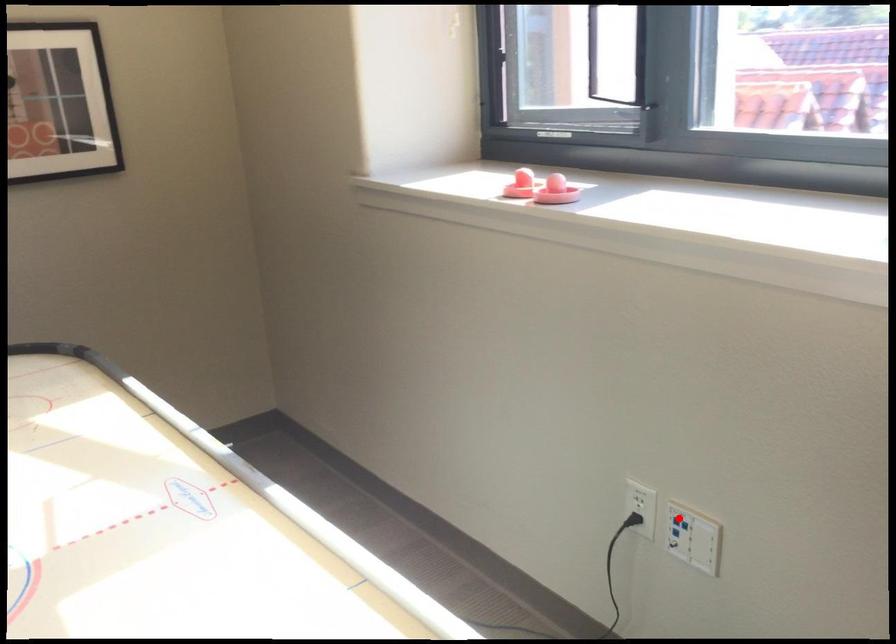
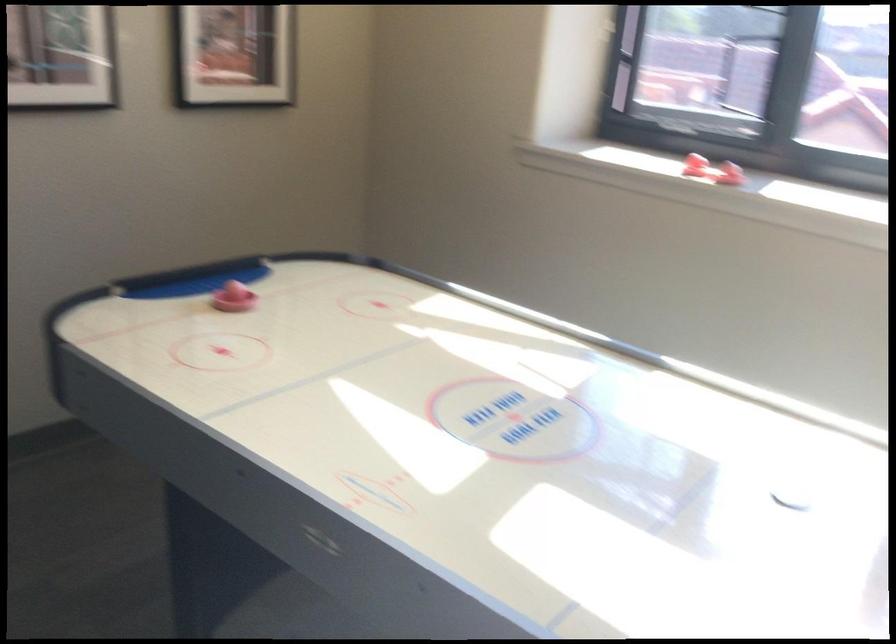
Question: I am providing you with two images of the same scene from different viewpoints. A red point is marked on the first image. Can you still see the location of the red point in image 2?

Choices:
 (A) Yes
 (B) No

Answer: (B)